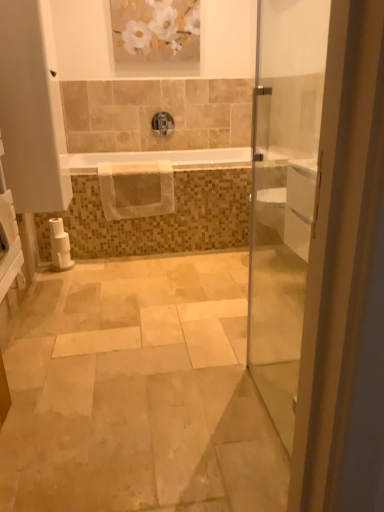
Question: Is white matte painting at upper center facing towards white glossy bathtub at center?

Choices:
 (A) yes
 (B) no

Answer: (B)

Question: Is white matte painting at upper center thinner than white glossy bathtub at center?

Choices:
 (A) yes
 (B) no

Answer: (A)

Question: Can you confirm if white matte painting at upper center is wider than white glossy bathtub at center?

Choices:
 (A) no
 (B) yes

Answer: (A)

Question: Is white matte painting at upper center positioned beyond the bounds of white glossy bathtub at center?

Choices:
 (A) yes
 (B) no

Answer: (A)

Question: Is white matte painting at upper center at the right side of white glossy bathtub at center?

Choices:
 (A) no
 (B) yes

Answer: (A)

Question: Considering the positions of white matte painting at upper center and white textured hand towel at center in the image, is white matte painting at upper center taller or shorter than white textured hand towel at center?

Choices:
 (A) short
 (B) tall

Answer: (B)

Question: Considering their positions, is white matte painting at upper center located in front of or behind white textured hand towel at center?

Choices:
 (A) behind
 (B) front

Answer: (A)

Question: From a real-world perspective, relative to white textured hand towel at center, is white matte painting at upper center vertically above or below?

Choices:
 (A) above
 (B) below

Answer: (A)

Question: Is white matte painting at upper center wider or thinner than white textured hand towel at center?

Choices:
 (A) wide
 (B) thin

Answer: (B)

Question: Considering the positions of white glossy door at right and white matte toilet paper at lower left in the image, is white glossy door at right bigger or smaller than white matte toilet paper at lower left?

Choices:
 (A) small
 (B) big

Answer: (B)

Question: From a real-world perspective, is white glossy door at right above or below white matte toilet paper at lower left?

Choices:
 (A) above
 (B) below

Answer: (A)

Question: Choose the correct answer: Is white glossy door at right inside white matte toilet paper at lower left or outside it?

Choices:
 (A) inside
 (B) outside

Answer: (B)

Question: Looking at their shapes, would you say white glossy door at right is wider or thinner than white matte toilet paper at lower left?

Choices:
 (A) thin
 (B) wide

Answer: (A)

Question: In terms of size, does white matte painting at upper center appear bigger or smaller than white glossy door at right?

Choices:
 (A) big
 (B) small

Answer: (B)

Question: From a real-world perspective, is white matte painting at upper center positioned above or below white glossy door at right?

Choices:
 (A) below
 (B) above

Answer: (B)